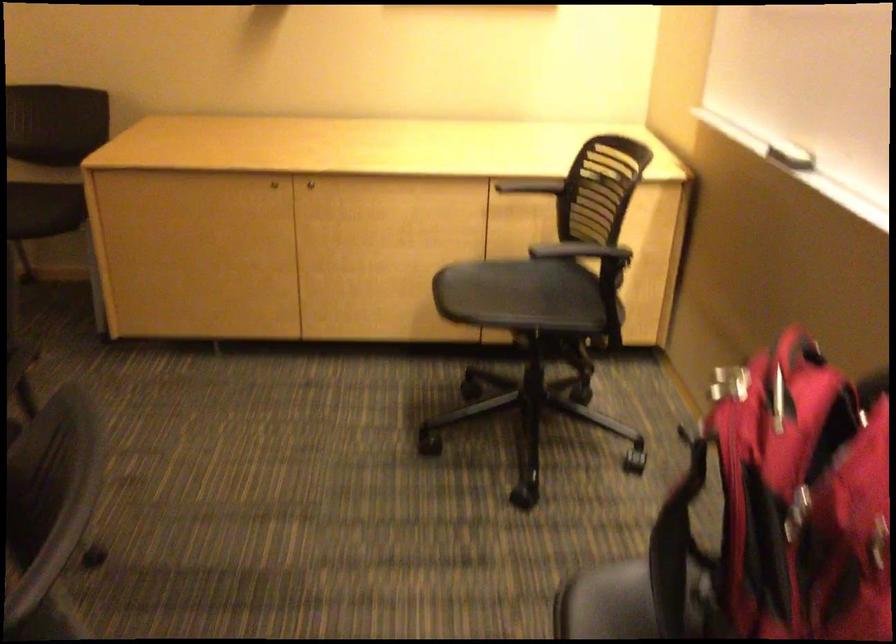
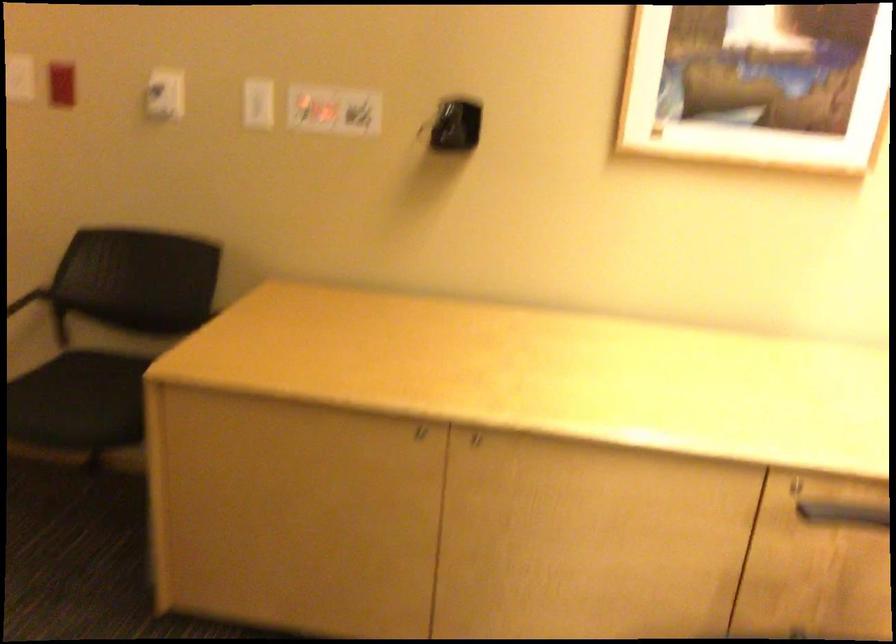
Question: In a continuous first-person perspective shot, in which direction is the camera moving?

Choices:
 (A) Left
 (B) Right
 (C) Forward
 (D) Backward

Answer: (C)